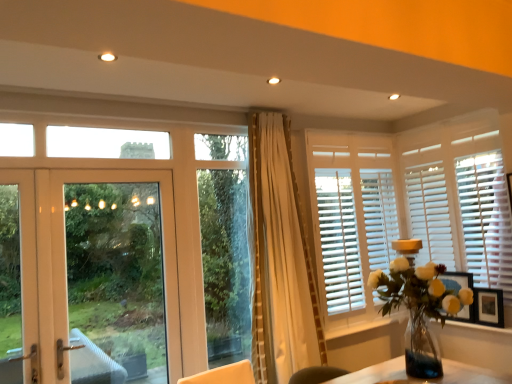
Question: Looking at their shapes, would you say white wood door at left is wider or thinner than translucent glass vase at right?

Choices:
 (A) wide
 (B) thin

Answer: (B)

Question: Is point (140, 210) positioned closer to the camera than point (420, 372)?

Choices:
 (A) farther
 (B) closer

Answer: (A)

Question: Based on their relative distances, which object is nearer to the white textured curtain at center?

Choices:
 (A) white wooden blinds at upper right
 (B) white wood window sill at lower right
 (C) white wood blinds at right
 (D) wooden picture frame at right
 (E) white wood window frame at center

Answer: (E)

Question: Estimate the real-world distances between objects in this image. Which object is farther from the white wood window frame at center?

Choices:
 (A) translucent glass vase at right
 (B) white wooden blinds at upper right
 (C) white wood blinds at right
 (D) wooden picture frame at right
 (E) white wood door at left

Answer: (D)